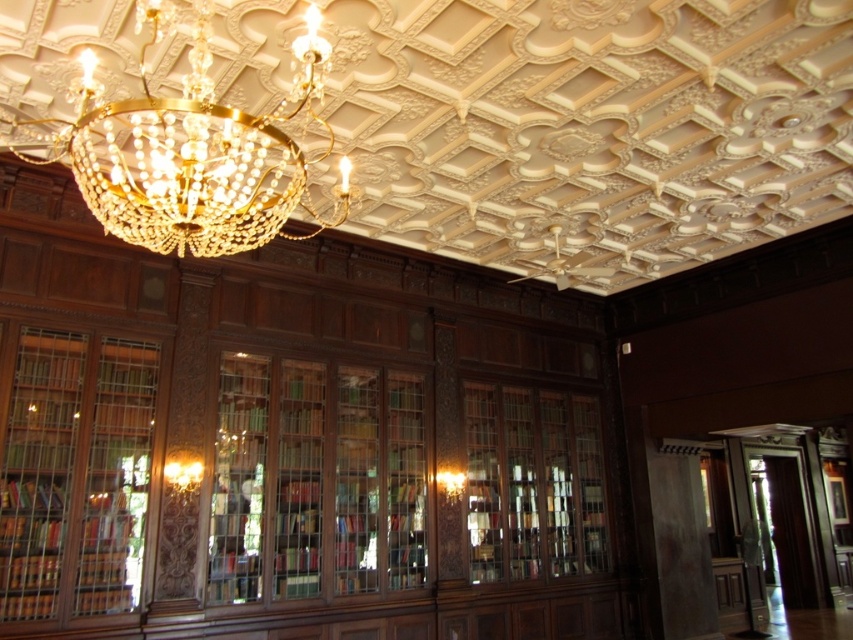
Question: Can you confirm if gold crystal chandelier at upper center is positioned above wooden bookcase at left?

Choices:
 (A) yes
 (B) no

Answer: (A)

Question: Which point is closer to the camera?

Choices:
 (A) (125, 476)
 (B) (254, 218)

Answer: (B)

Question: Is gold crystal chandelier at upper center smaller than wooden bookcase at left?

Choices:
 (A) no
 (B) yes

Answer: (A)

Question: Which point is farther from the camera taking this photo?

Choices:
 (A) (126, 406)
 (B) (239, 237)

Answer: (A)

Question: Is gold crystal chandelier at upper center to the right of wooden bookcase at left from the viewer's perspective?

Choices:
 (A) no
 (B) yes

Answer: (B)